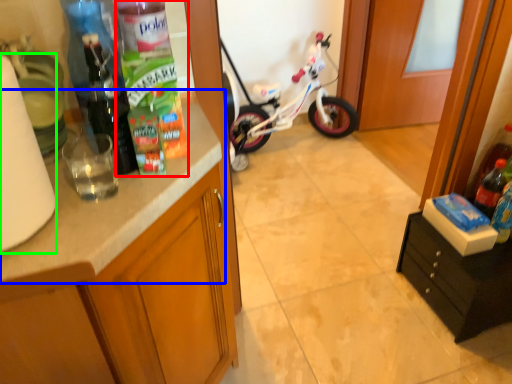
Question: Which object is the closest to the bottle (highlighted by a red box)? Choose among these: countertop (highlighted by a blue box) or paper towel (highlighted by a green box).

Choices:
 (A) countertop
 (B) paper towel

Answer: (A)